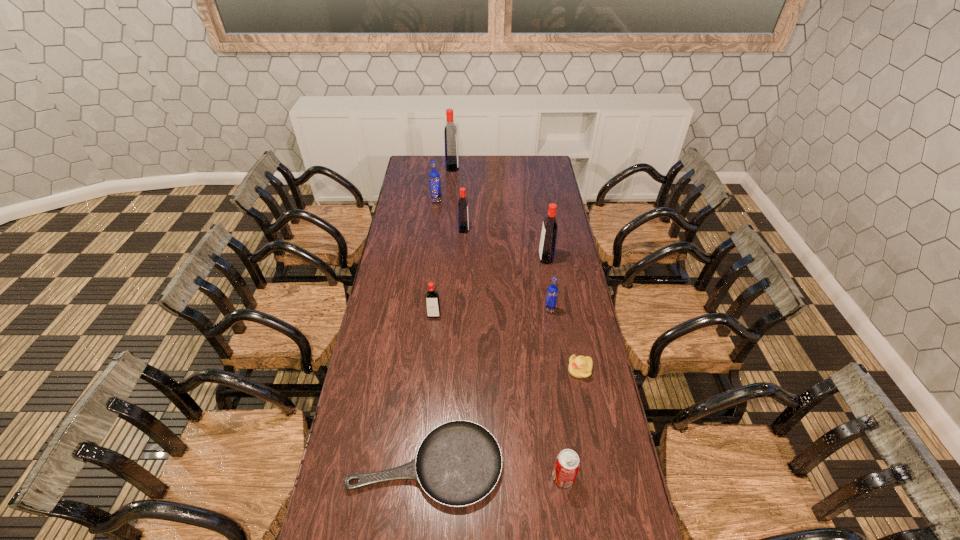
This screenshot has height=540, width=960. I want to click on the farthest vodka, so click(450, 132).

Locate an element on the screen. the tallest object is located at coordinates (450, 132).

The image size is (960, 540). In order to click on the rightmost red vodka in this screenshot , I will do click(547, 245).

I want to click on the fifth shortest vodka, so click(547, 245).

Find the location of a particular element. The image size is (960, 540). the eighth nearest object is located at coordinates (434, 178).

This screenshot has width=960, height=540. In order to click on the left blue vodka in this screenshot , I will do `click(434, 178)`.

Locate an element on the screen. Image resolution: width=960 pixels, height=540 pixels. the third biggest red vodka is located at coordinates (463, 218).

Where is `the third red vodka from left to right`? This screenshot has height=540, width=960. the third red vodka from left to right is located at coordinates (463, 218).

Where is `the right blue vodka`? Image resolution: width=960 pixels, height=540 pixels. the right blue vodka is located at coordinates (552, 291).

Identify the location of the smaller blue vodka. Image resolution: width=960 pixels, height=540 pixels. (552, 291).